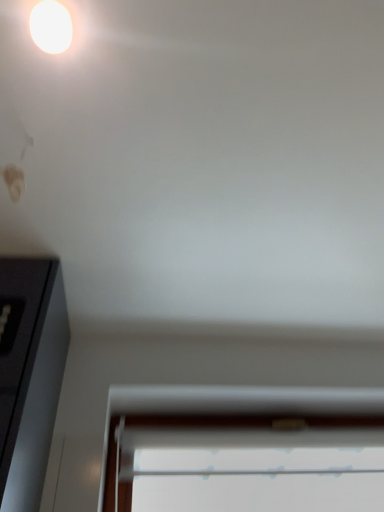
Locate an element on the screen. white plastic window at lower center is located at coordinates (242, 449).

Describe the element at coordinates (242, 449) in the screenshot. I see `white plastic window at lower center` at that location.

You are a GUI agent. You are given a task and a screenshot of the screen. Output one action in this format:
    pyautogui.click(x=<x>, y=<y>)
    Task: Click on the white plastic window at lower center
    Image resolution: width=384 pixels, height=512 pixels.
    Given the screenshot: What is the action you would take?
    pyautogui.click(x=242, y=449)